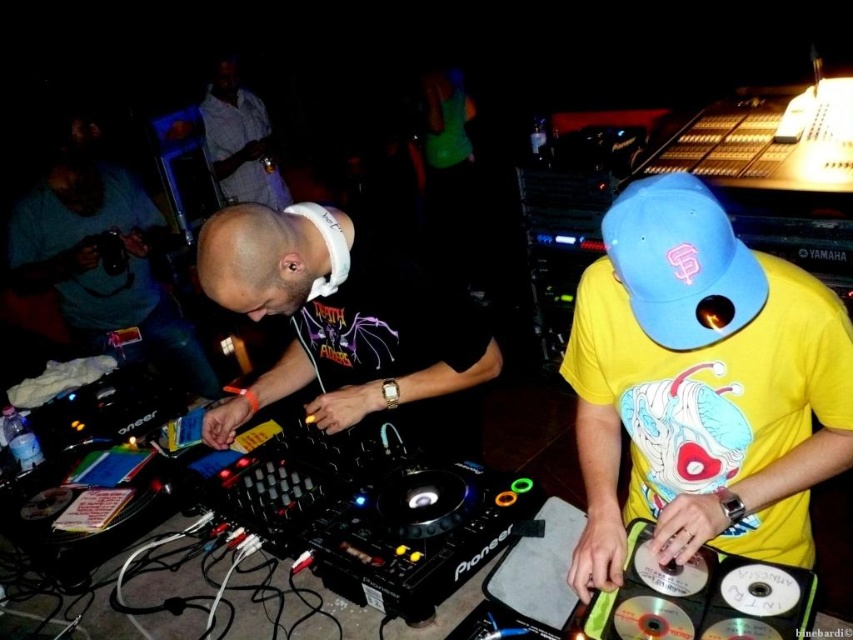
Can you confirm if yellow matte shirt at center is bigger than striped shirt at upper left?

No, yellow matte shirt at center is not bigger than striped shirt at upper left.

Is point (660, 177) behind point (236, 134)?

No, (660, 177) is in front of (236, 134).

This screenshot has width=853, height=640. Find the location of `yellow matte shirt at center`. yellow matte shirt at center is located at coordinates (701, 385).

Can you confirm if yellow matte shirt at center is shorter than white matte headphones at center?

No.

In the scene shown: Who is taller, yellow matte shirt at center or white matte headphones at center?

Standing taller between the two is yellow matte shirt at center.

Locate an element on the screen. This screenshot has width=853, height=640. yellow matte shirt at center is located at coordinates (701, 385).

Which is above, white matte headphones at center or striped shirt at upper left?

striped shirt at upper left

Which is behind, point (381, 362) or point (222, 170)?

The point (222, 170) is behind.

Is point (233, 253) more distant than point (212, 170)?

No, it is not.

Find the location of a particular element. The height and width of the screenshot is (640, 853). white matte headphones at center is located at coordinates (341, 321).